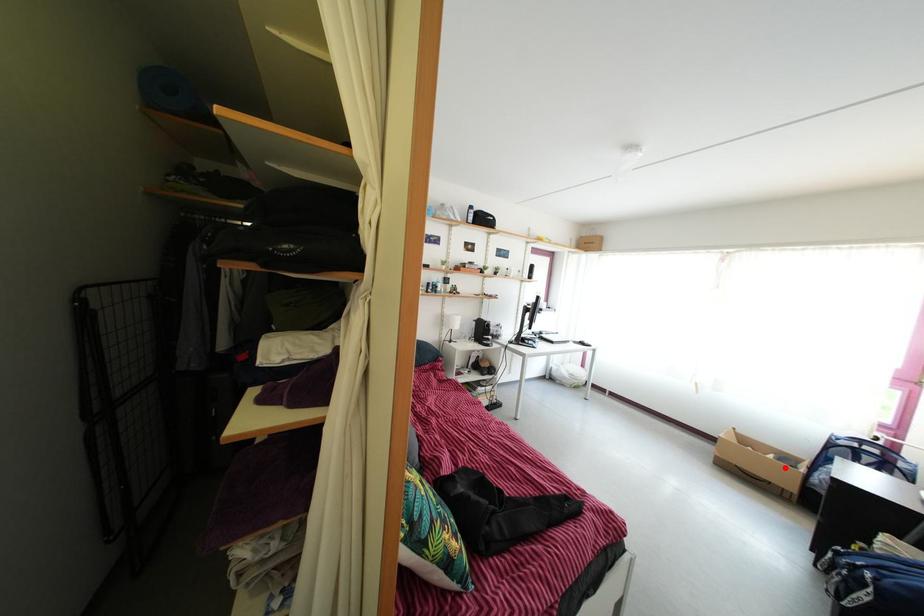
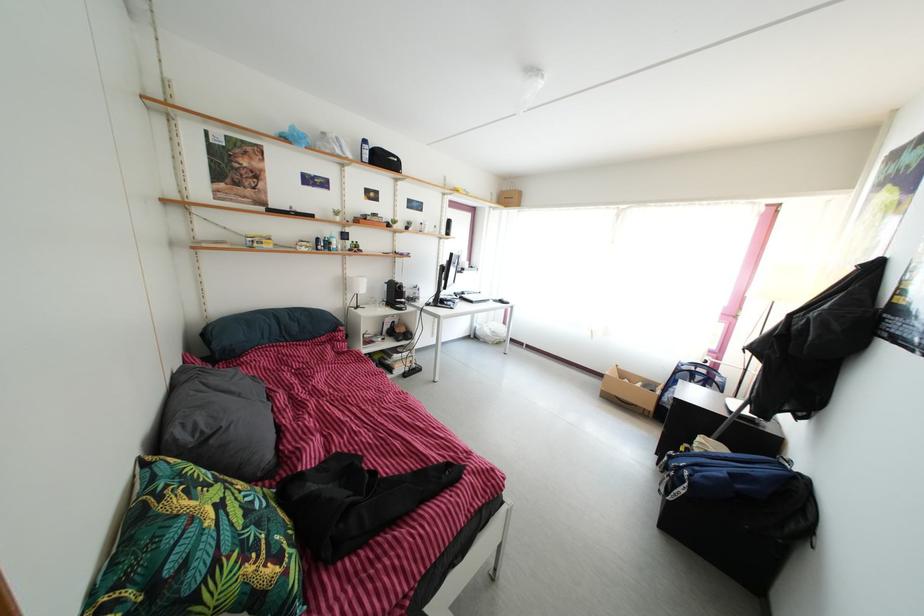
Question: I am providing you with two images of the same scene from different viewpoints. Given a red point in image1, look at the same physical point in image2. Is it:

Choices:
 (A) Closer to the viewpoint
 (B) Farther from the viewpoint

Answer: (A)